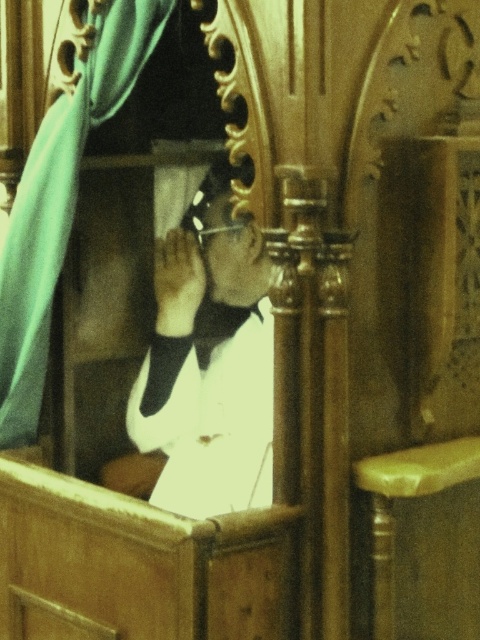
You are a visitor standing at the entrance of the church. You see the white glossy shirt at center and the teal fabric curtain at left. Which object is closer to the entrance?

The white glossy shirt at center is closer to the entrance because it is below the teal fabric curtain at left, indicating it is positioned lower and therefore nearer to the visitor standing at the entrance.

You are a photographer trying to capture a clear shot of the white glossy shirt at center and the teal fabric curtain at left. Since the camera can only focus on one object at a time, which object should you choose to ensure it appears sharp and in focus, considering their sizes?

The white glossy shirt at center is larger in size than the teal fabric curtain at left, so you should focus on the white glossy shirt at center to ensure it appears sharp and in focus.

You are attending a religious ceremony and notice the clergy member wearing a white glossy shirt at center and a black satin bow tie at center. Which clothing item is wider?

The white glossy shirt at center is wider than the black satin bow tie at center.